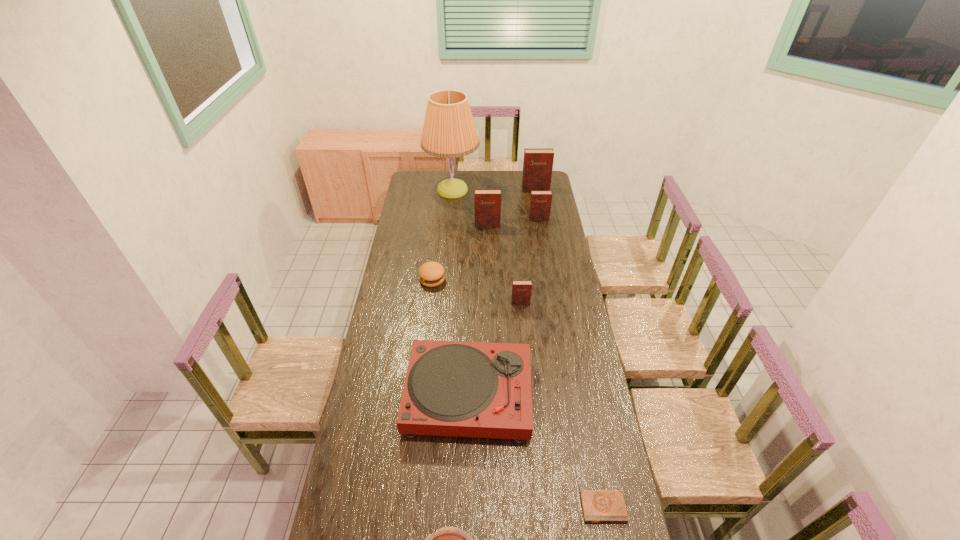
Where is `red record player`? The height and width of the screenshot is (540, 960). red record player is located at coordinates (452, 388).

Find the location of a particular element. This screenshot has width=960, height=540. record player is located at coordinates (452, 388).

Locate an element on the screen. hamburger is located at coordinates pyautogui.click(x=431, y=274).

You are a GUI agent. You are given a task and a screenshot of the screen. Output one action in this format:
    pyautogui.click(x=<x>, y=<y>)
    Task: Click on the brown hamburger
    
    Given the screenshot: What is the action you would take?
    pyautogui.click(x=431, y=274)

Locate an element on the screen. This screenshot has width=960, height=540. the nearest diary is located at coordinates (599, 506).

At what (x,y) coordinates should I click in order to perform the action: click on the second nearest object. Please return your answer as a coordinate pair (x, y). Looking at the image, I should click on (599, 506).

Where is `free space located 0.080m on the side of the tallest object near the pull switch`? The image size is (960, 540). free space located 0.080m on the side of the tallest object near the pull switch is located at coordinates (492, 190).

Image resolution: width=960 pixels, height=540 pixels. Find the location of `vacant space located 0.110m on the front cover of the biggest reddish-brown diary`. vacant space located 0.110m on the front cover of the biggest reddish-brown diary is located at coordinates (538, 202).

Locate an element on the screen. This screenshot has height=540, width=960. vacant area located 0.380m on the front cover of the second biggest reddish-brown diary is located at coordinates (489, 273).

At what (x,y) coordinates should I click in order to perform the action: click on vacant space located on the front cover of the third farthest object. Please return your answer as a coordinate pair (x, y). Looking at the image, I should click on (544, 252).